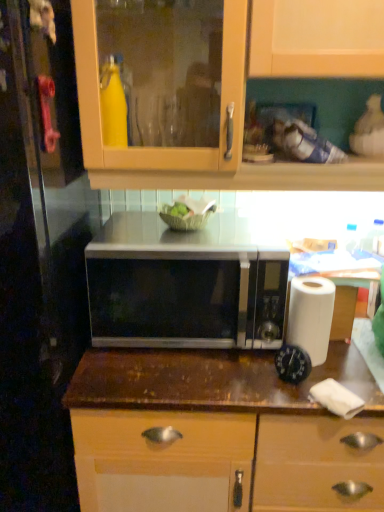
This screenshot has height=512, width=384. I want to click on vacant space that is to the left of white paper at right, so click(x=238, y=371).